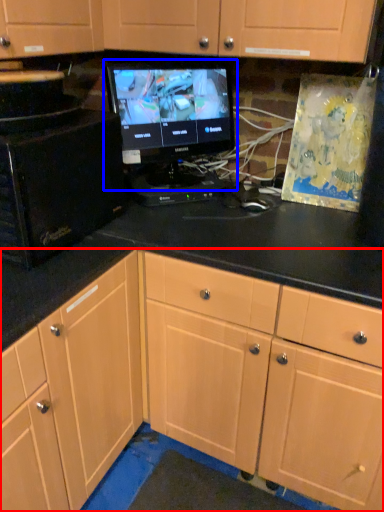
Question: Which point is further to the camera, cabinetry (highlighted by a red box) or computer monitor (highlighted by a blue box)?

Choices:
 (A) cabinetry
 (B) computer monitor

Answer: (B)